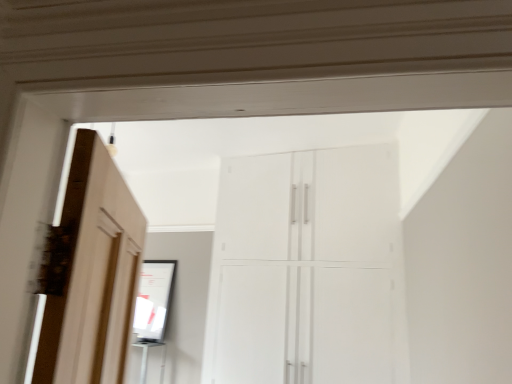
Question: Would you say white glossy cupboard at center is to the left or to the right of matte black mirror at center in the picture?

Choices:
 (A) right
 (B) left

Answer: (A)

Question: Is white glossy cupboard at center in front of or behind matte black mirror at center in the image?

Choices:
 (A) front
 (B) behind

Answer: (A)

Question: From the image's perspective, is white glossy cupboard at center located above or below matte black mirror at center?

Choices:
 (A) above
 (B) below

Answer: (A)

Question: In the image, is matte black mirror at center positioned in front of or behind white glossy cupboard at center?

Choices:
 (A) front
 (B) behind

Answer: (B)

Question: From the image's perspective, is matte black mirror at center above or below white glossy cupboard at center?

Choices:
 (A) above
 (B) below

Answer: (B)

Question: Based on their sizes in the image, would you say matte black mirror at center is bigger or smaller than white glossy cupboard at center?

Choices:
 (A) small
 (B) big

Answer: (A)

Question: Is point (147, 261) positioned closer to the camera than point (258, 253)?

Choices:
 (A) closer
 (B) farther

Answer: (B)